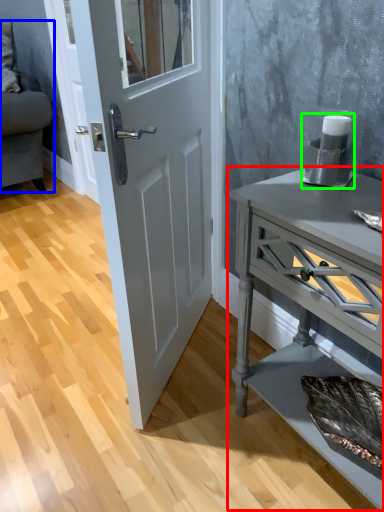
Question: Based on their relative distances, which object is nearer to nightstand (highlighted by a red box)? Choose from studio couch (highlighted by a blue box) and appliance (highlighted by a green box).

Choices:
 (A) studio couch
 (B) appliance

Answer: (B)